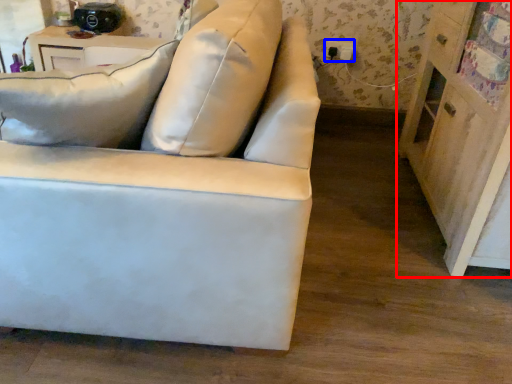
Question: Which point is closer to the camera, dresser (highlighted by a red box) or electric outlet (highlighted by a blue box)?

Choices:
 (A) dresser
 (B) electric outlet

Answer: (A)